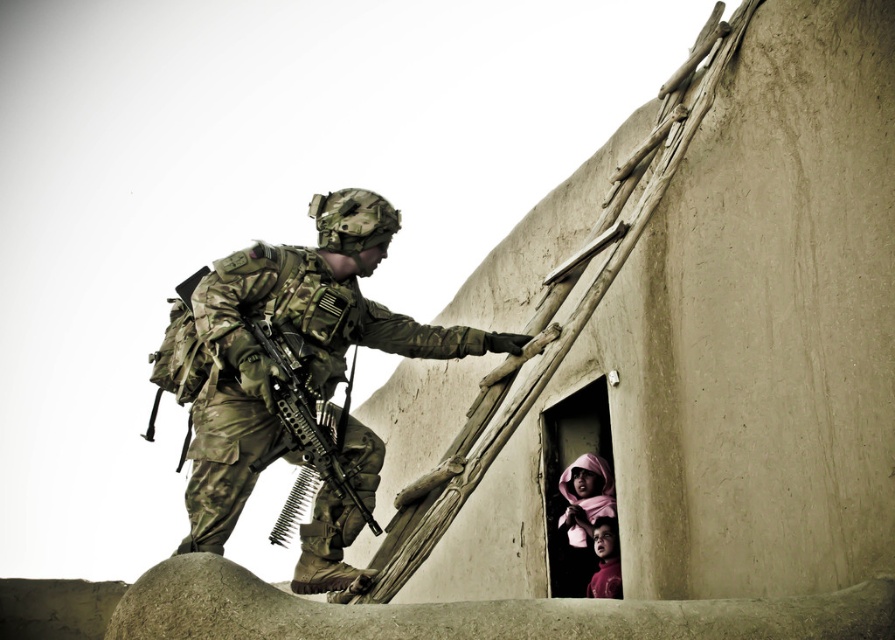
Is camouflage uniform at center wider than camouflage-patterned rifle at center?

Correct, the width of camouflage uniform at center exceeds that of camouflage-patterned rifle at center.

Which of these two, camouflage uniform at center or camouflage-patterned rifle at center, stands shorter?

Standing shorter between the two is camouflage-patterned rifle at center.

Who is more forward, (256, 252) or (286, 355)?

Point (286, 355) is in front.

Find the location of a particular element. camouflage uniform at center is located at coordinates (297, 336).